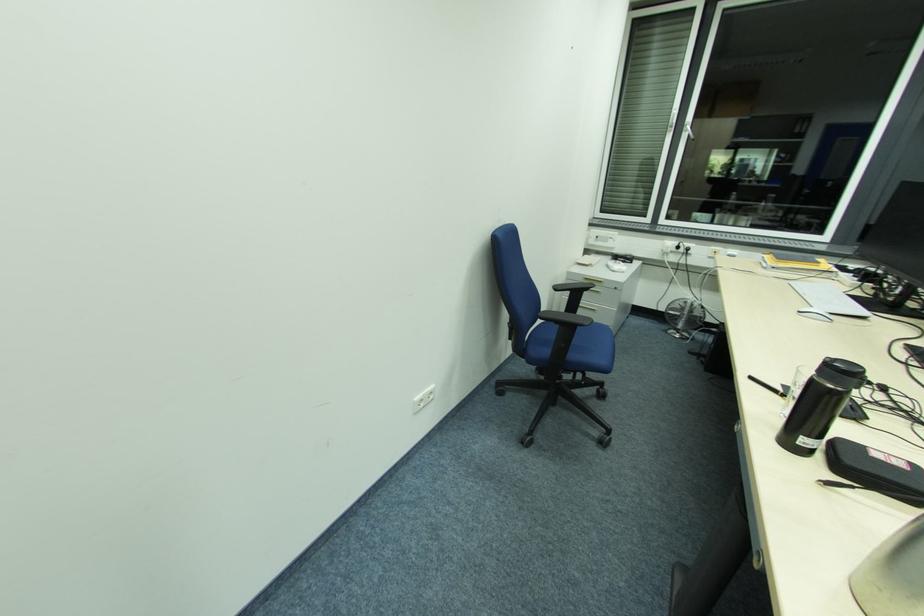
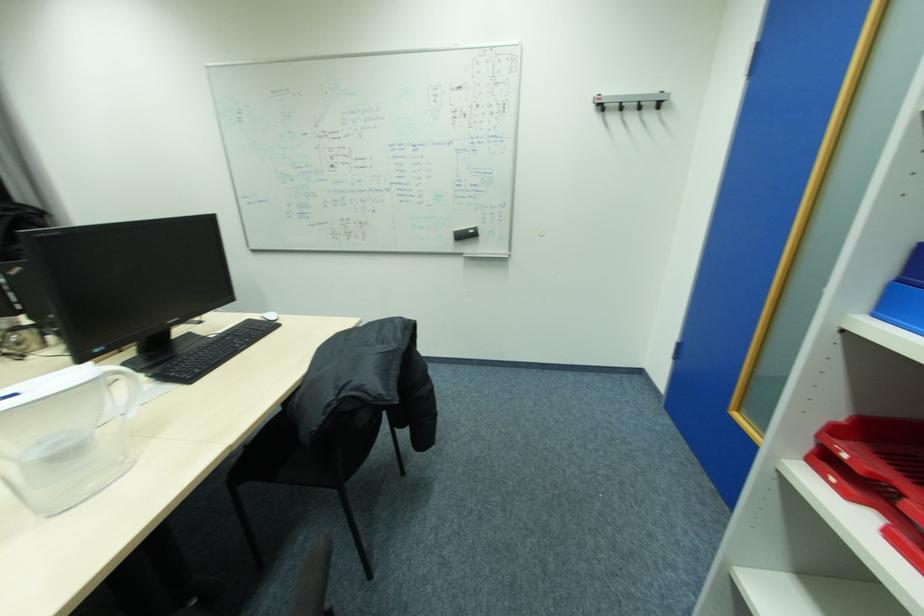
How did the camera likely rotate?

The camera's rotation is toward right-down.